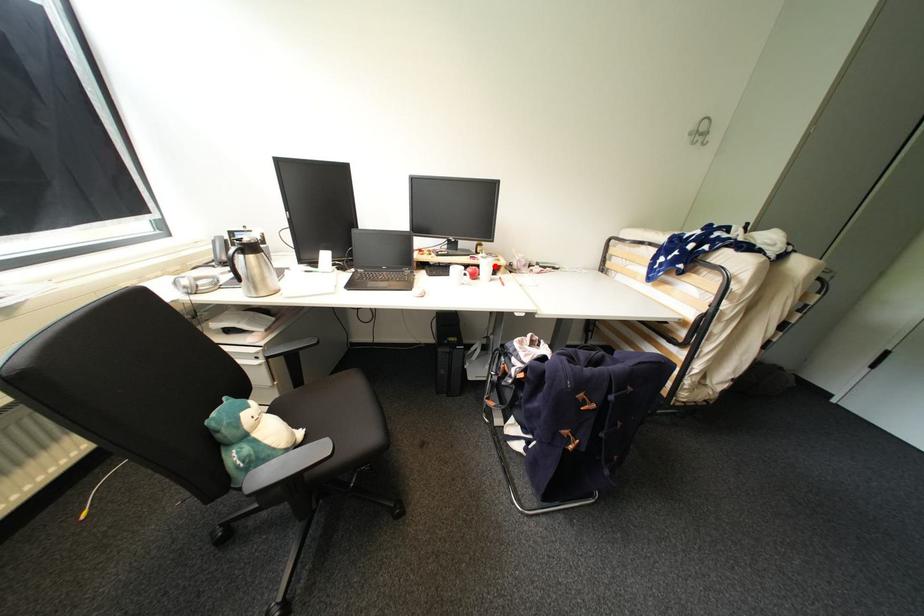
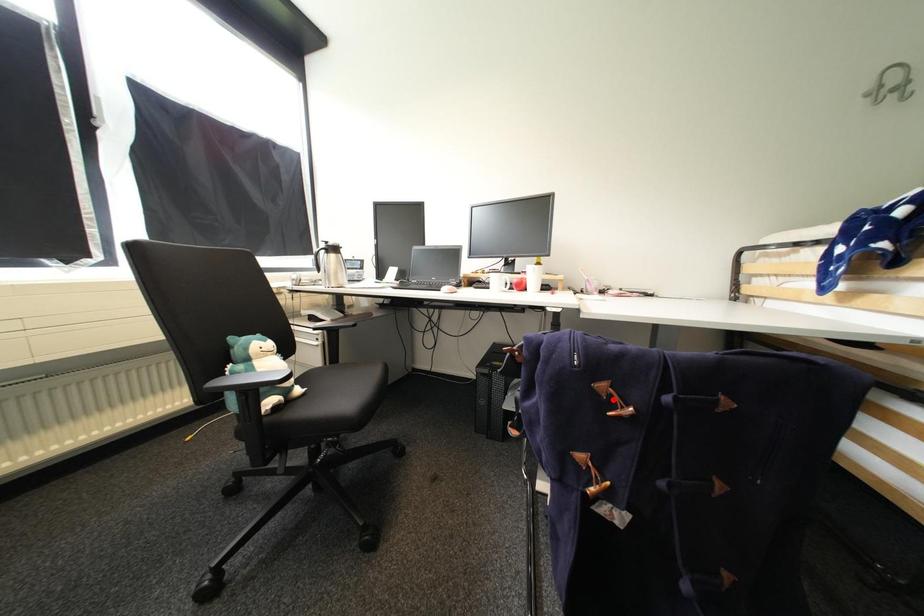
I am providing you with two images of the same scene from different viewpoints. A red point is marked on the first image and another point is marked on the second image. Is the marked point in image1 the same physical position as the marked point in image2?

No